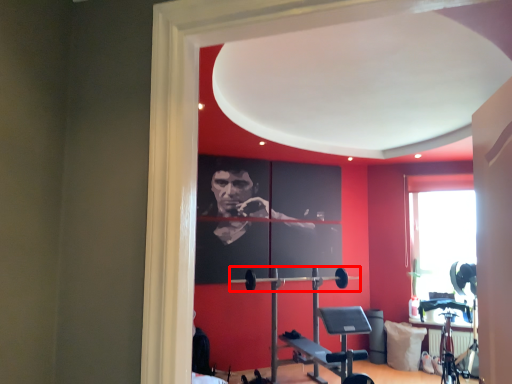
Question: Observing the image, what is the correct spatial positioning of barbell (annotated by the red box) in reference to pillow?

Choices:
 (A) left
 (B) right

Answer: (A)